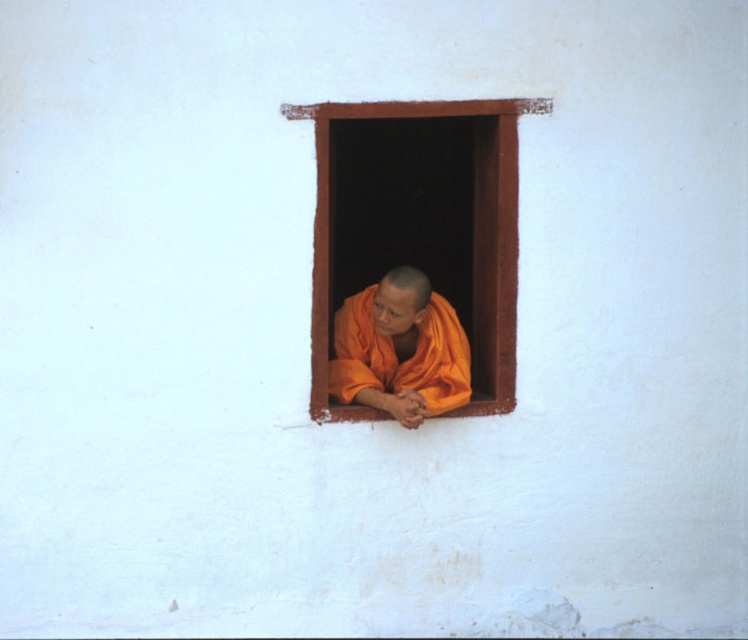
Does orange cloth monk at center appear over brown wooden window at center?

No.

Can you confirm if orange cloth monk at center is wider than brown wooden window at center?

In fact, orange cloth monk at center might be narrower than brown wooden window at center.

Between point (420, 371) and point (387, 113), which one is positioned in front?

Point (387, 113)

Locate an element on the screen. Image resolution: width=748 pixels, height=640 pixels. orange cloth monk at center is located at coordinates (399, 349).